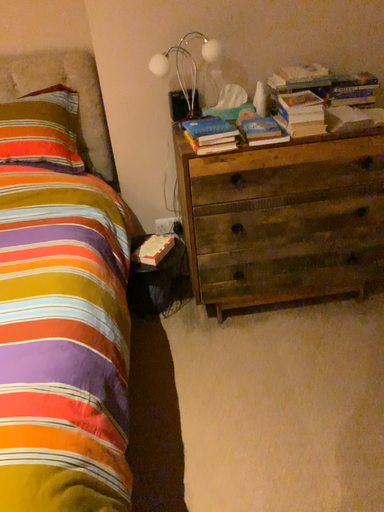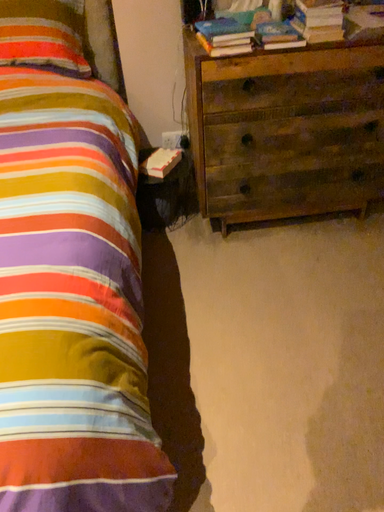
Question: How did the camera likely rotate when shooting the video?

Choices:
 (A) rotated downward
 (B) rotated upward

Answer: (A)